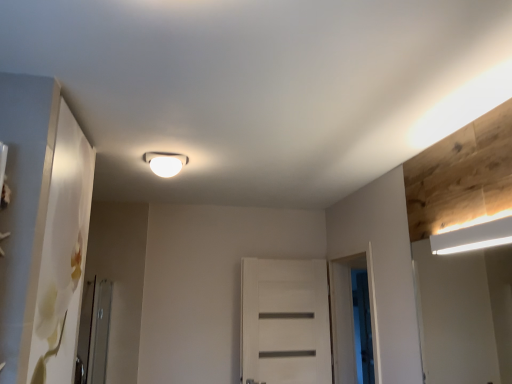
Question: Can you confirm if white matte rectangular light fixture at upper right, the first lamp from the bottom, is taller than white matte screen door at center, marked as the 2th screen door in a left-to-right arrangement?

Choices:
 (A) no
 (B) yes

Answer: (A)

Question: Could you tell me if white matte rectangular light fixture at upper right, positioned as the second lamp in back-to-front order, is facing white matte screen door at center, the second screen door in the front-to-back sequence?

Choices:
 (A) no
 (B) yes

Answer: (A)

Question: Are white matte rectangular light fixture at upper right, positioned as the second lamp in back-to-front order, and white matte screen door at center, positioned as the 2th screen door in right-to-left order, beside each other?

Choices:
 (A) no
 (B) yes

Answer: (A)

Question: Is white matte rectangular light fixture at upper right, the 1th lamp from the front, at the right side of white matte screen door at center, the 2th screen door when ordered from back to front?

Choices:
 (A) no
 (B) yes

Answer: (B)

Question: Considering the relative sizes of white matte rectangular light fixture at upper right, the 1th lamp from the front, and white matte screen door at center, the second screen door in the front-to-back sequence, in the image provided, is white matte rectangular light fixture at upper right, the 1th lamp from the front, shorter than white matte screen door at center, the second screen door in the front-to-back sequence,?

Choices:
 (A) yes
 (B) no

Answer: (A)

Question: From a real-world perspective, is clear glass screen door at lower left, positioned as the third screen door in back-to-front order, positioned above or below white matte door at center?

Choices:
 (A) above
 (B) below

Answer: (B)

Question: Based on their sizes in the image, would you say clear glass screen door at lower left, the first screen door positioned from the front, is bigger or smaller than white matte door at center?

Choices:
 (A) small
 (B) big

Answer: (B)

Question: Is clear glass screen door at lower left, the first screen door positioned from the front, inside or outside of white matte door at center?

Choices:
 (A) outside
 (B) inside

Answer: (A)

Question: Looking at their shapes, would you say clear glass screen door at lower left, positioned as the third screen door in back-to-front order, is wider or thinner than white matte door at center?

Choices:
 (A) wide
 (B) thin

Answer: (A)

Question: From a real-world perspective, is white matte rectangular light fixture at upper right, which is the first lamp in right-to-left order, above or below white matte screen door at center, the second screen door in the front-to-back sequence?

Choices:
 (A) above
 (B) below

Answer: (A)

Question: Is white matte rectangular light fixture at upper right, the first lamp from the bottom, in front of or behind white matte screen door at center, the second screen door in the front-to-back sequence, in the image?

Choices:
 (A) front
 (B) behind

Answer: (A)

Question: In the image, is white matte rectangular light fixture at upper right, the first lamp from the bottom, on the left side or the right side of white matte screen door at center, the 2th screen door when ordered from back to front?

Choices:
 (A) left
 (B) right

Answer: (B)

Question: Considering the positions of point (458, 235) and point (352, 322), is point (458, 235) closer or farther from the camera than point (352, 322)?

Choices:
 (A) farther
 (B) closer

Answer: (B)

Question: Is clear glass screen door at lower left, the first screen door positioned from the front, to the left or to the right of white matte rectangular light fixture at upper right, which appears as the second lamp when viewed from the left, in the image?

Choices:
 (A) left
 (B) right

Answer: (A)

Question: Based on their sizes in the image, would you say clear glass screen door at lower left, which is the 3th screen door from right to left, is bigger or smaller than white matte rectangular light fixture at upper right, the first lamp from the bottom?

Choices:
 (A) big
 (B) small

Answer: (A)